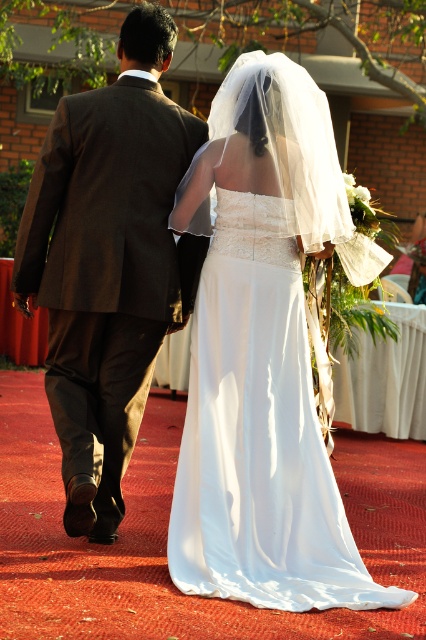
Between brown wool suit at left and white satin dress at center, which one appears on the right side from the viewer's perspective?

From the viewer's perspective, white satin dress at center appears more on the right side.

Between brown wool suit at left and white satin dress at center, which one is positioned higher?

brown wool suit at left

Locate an element on the screen. This screenshot has width=426, height=640. brown wool suit at left is located at coordinates (109, 262).